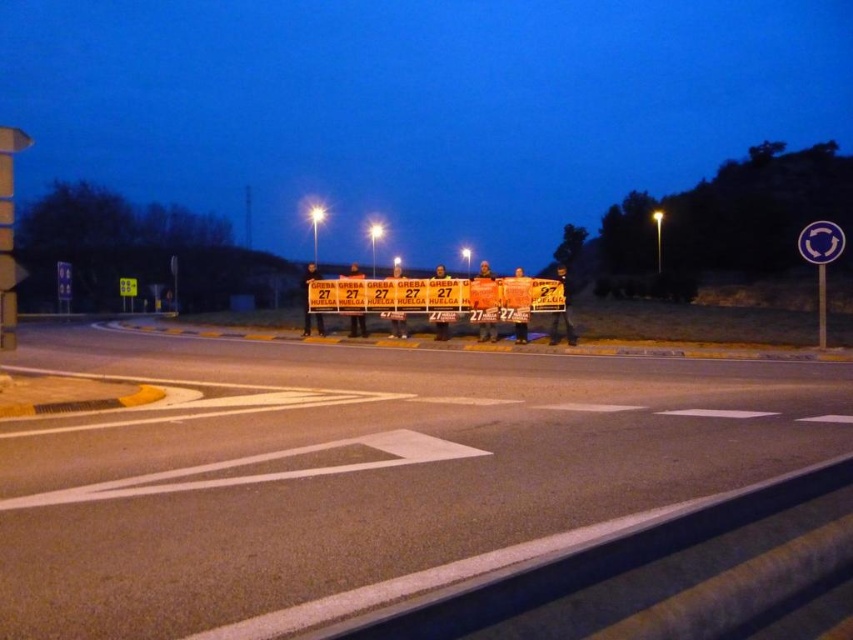
You are a driver approaching the intersection and see the metallic reflective circle at upper right and the yellow reflective square at upper left. Which of these two objects is wider?

The yellow reflective square at upper left is wider than the metallic reflective circle at upper right.

You are driving a car and approaching the intersection. You see two points marked on the road ahead. The first point is at coordinate point (805, 257) and the second is at point (135, 285). According to the scene description, which point would you reach first while driving straight ahead?

Point (805, 257) is in front of point (135, 285), so you would reach point (805, 257) first while driving straight ahead.